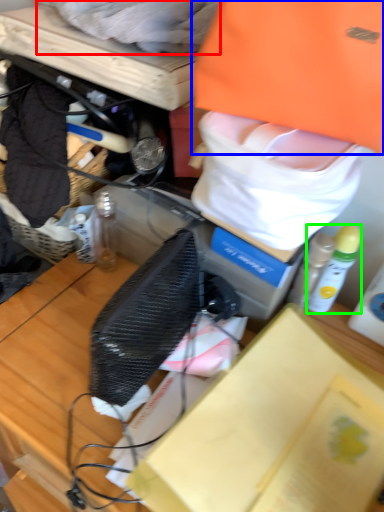
Question: Which is farther away from clothing (highlighted by a red box)? clothing (highlighted by a blue box) or bottle (highlighted by a green box)?

Choices:
 (A) clothing
 (B) bottle

Answer: (B)